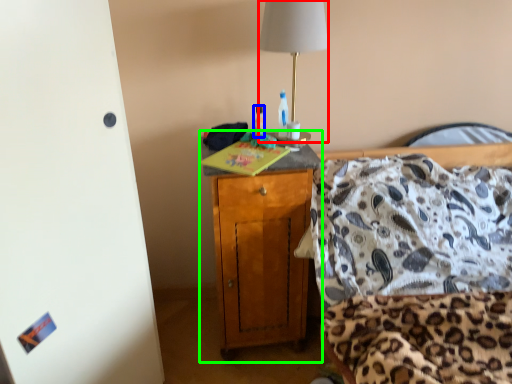
Question: Based on their relative distances, which object is nearer to lamp (highlighted by a red box)? Choose from bottle (highlighted by a blue box) and cabinetry (highlighted by a green box).

Choices:
 (A) bottle
 (B) cabinetry

Answer: (A)